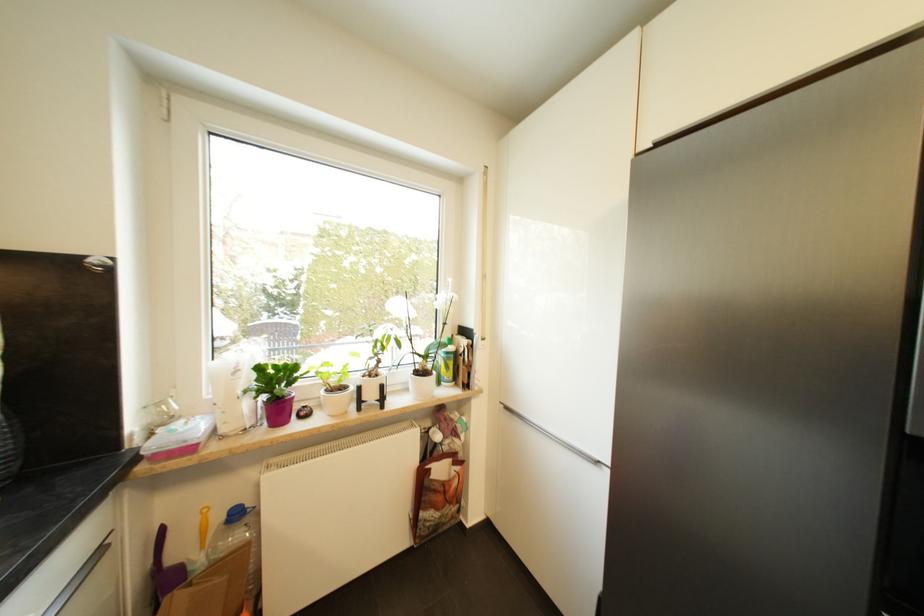
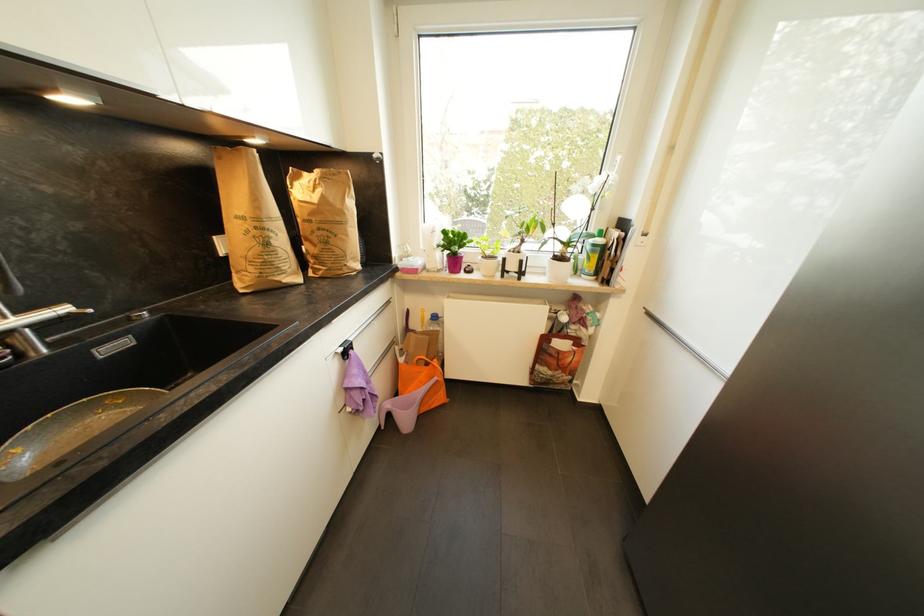
First-person continuous shooting, in which direction is the camera rotating?

The camera's rotation is toward left-down.